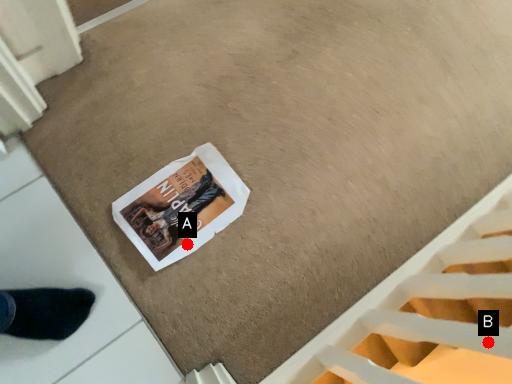
Question: Two points are circled on the image, labeled by A and B beside each circle. Which of the following is the farthest from the observer?

Choices:
 (A) A is further
 (B) B is further

Answer: (A)